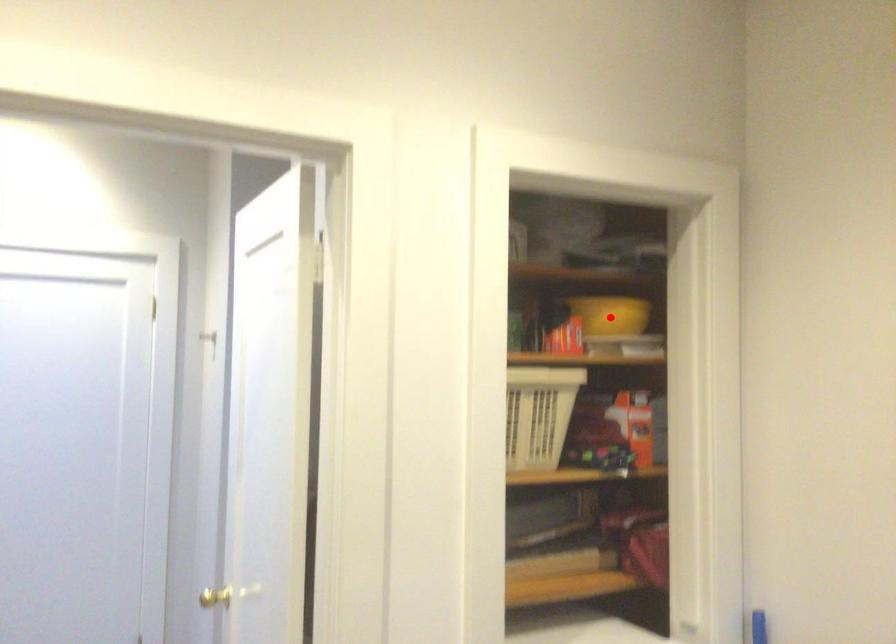
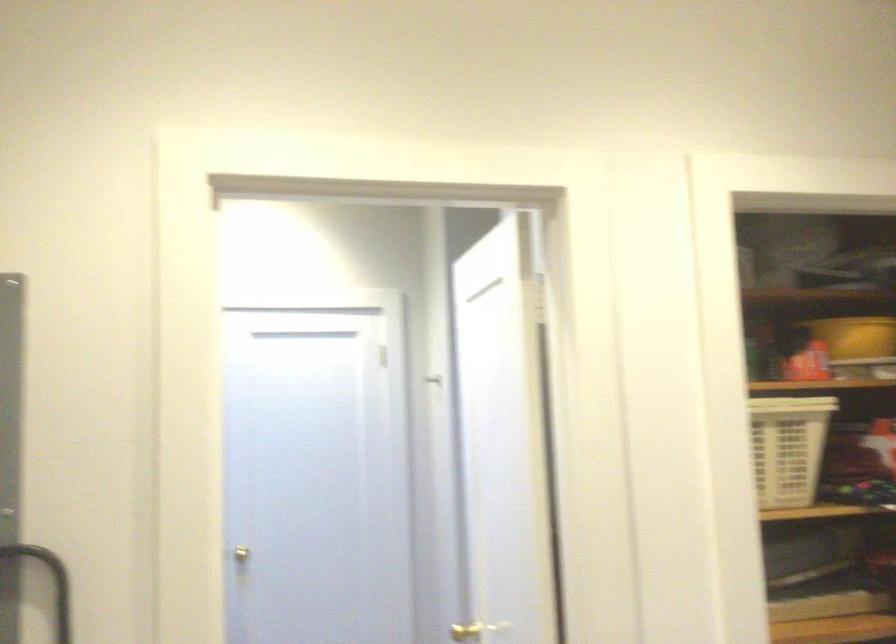
Where in the second image is the point corresponding to the highlighted location from the first image?

(855, 337)